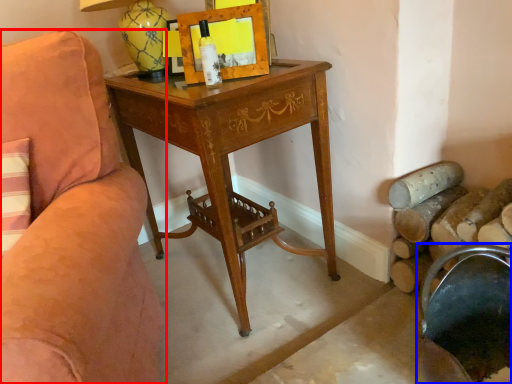
Question: Which object is closer to the camera taking this photo, chair (highlighted by a red box) or rocking chair (highlighted by a blue box)?

Choices:
 (A) chair
 (B) rocking chair

Answer: (A)